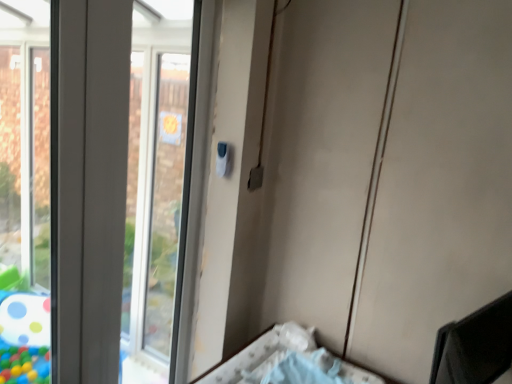
Locate an element on the screen. transparent glass bay window at left is located at coordinates 25,191.

Describe the element at coordinates (25, 191) in the screenshot. I see `transparent glass bay window at left` at that location.

The height and width of the screenshot is (384, 512). What are the coordinates of `transparent glass bay window at left` in the screenshot? It's located at (25, 191).